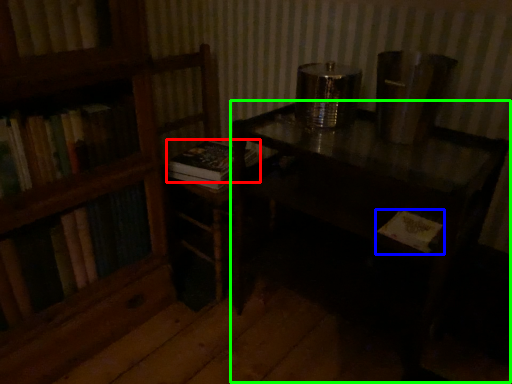
Question: Estimate the real-world distances between objects in this image. Which object is closer to book (highlighted by a red box), book (highlighted by a blue box) or table (highlighted by a green box)?

Choices:
 (A) book
 (B) table

Answer: (B)